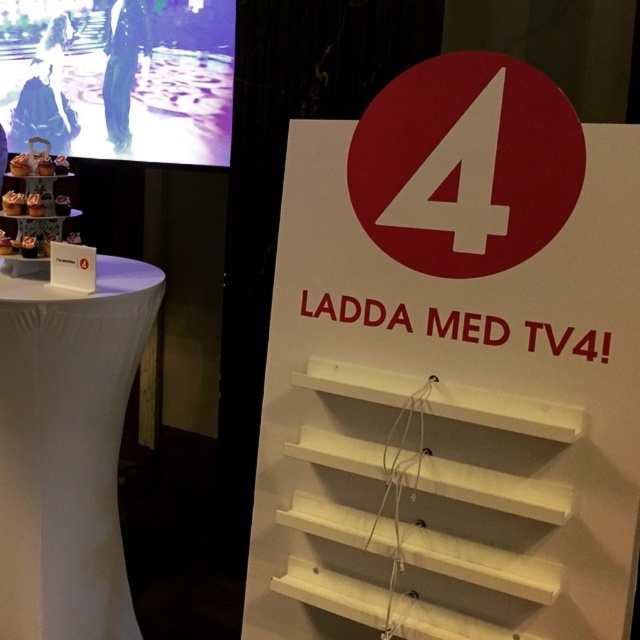
Looking at this image, which is above, white wood sign at center or white fabric-covered table at left?

white wood sign at center is above.

Which is behind, point (413, 211) or point (8, 378)?

The point (8, 378) is more distant.

What are the coordinates of `white wood sign at center` in the screenshot? It's located at (452, 365).